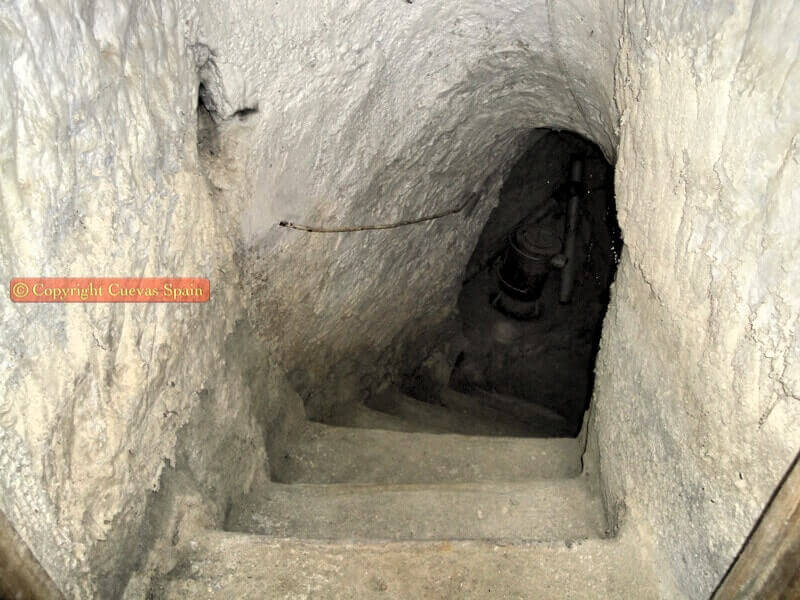
Locate an element on the screen. This screenshot has height=600, width=800. canister is located at coordinates (526, 264).